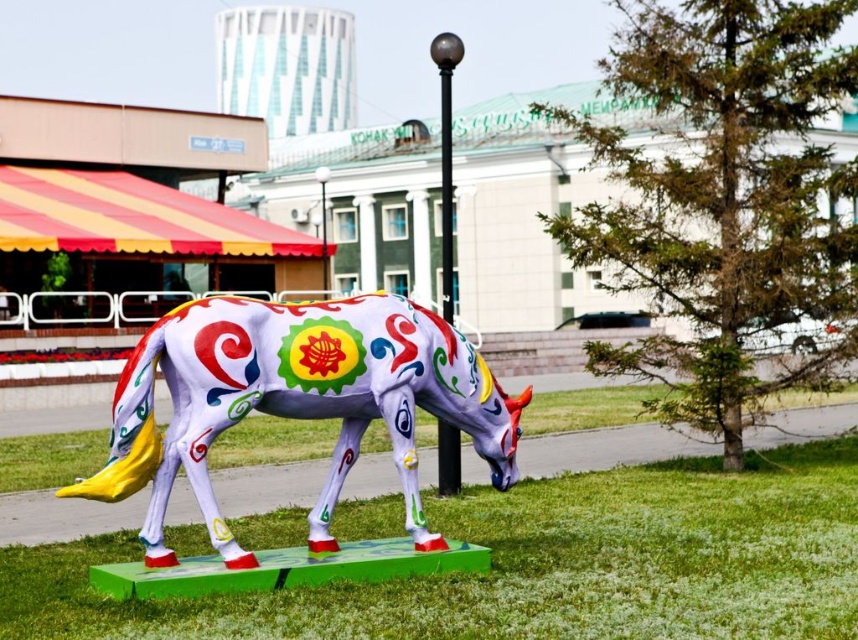
From the picture: You are standing in the grassy area and want to place a small picnic basket on the ground near the painted ceramic horse at center. Where should you put it to ensure it is on the same level as the green grass at center?

You should place the picnic basket on the green grass at center since it is below the painted ceramic horse at center, meaning the grass is at a lower level than the horse. Therefore, placing the basket on the grass ensures it is on the same level as the green grass at center.

You are a gardener who wants to mow the green grass at center. Since the painted ceramic horse at center is in the way, will you be able to mow the grass without moving the horse?

The green grass at center has a lesser height compared to painted ceramic horse at center, so the grass can be mowed without moving the horse as the horse is taller and won

You are standing in the grassy area and want to take a photo of the painted ceramic horse at center without any obstruction. Since you are standing on the green grass at center, can you move forward to get a clear shot?

The painted ceramic horse at center is behind the green grass at center, so moving forward might bring you closer to the grass, potentially blocking the view. To get an unobstructed photo, you should move backward to ensure the green grass at center is between you and the horse, allowing the horse to be visible without obstruction.